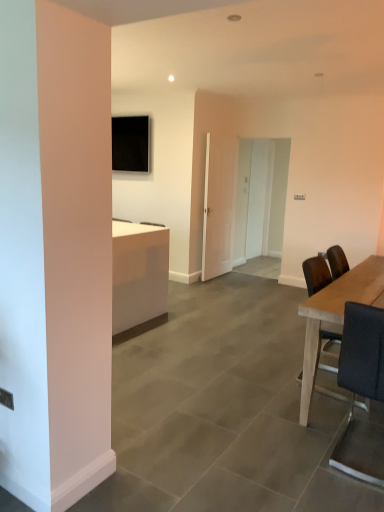
This screenshot has width=384, height=512. What do you see at coordinates (217, 206) in the screenshot?
I see `white glossy door at center, which is the first glass door from front to back` at bounding box center [217, 206].

Based on the photo, measure the distance between white glossy door at center, which is the first glass door from front to back, and camera.

white glossy door at center, which is the first glass door from front to back, and camera are 18.13 feet apart from each other.

Measure the distance between white glossy door at center, which ranks as the 1th glass door in back-to-front order, and camera.

white glossy door at center, which ranks as the 1th glass door in back-to-front order, is 23.34 feet away from camera.

The width and height of the screenshot is (384, 512). What are the coordinates of `white glossy door at center, the second glass door when ordered from front to back` in the screenshot? It's located at (261, 198).

The height and width of the screenshot is (512, 384). Find the location of `white glossy door at center, which is the first glass door from front to back`. white glossy door at center, which is the first glass door from front to back is located at coordinates (217, 206).

Is light brown wooden table at right bigger than white glossy door at center, which ranks as the 1th glass door in back-to-front order?

Yes, light brown wooden table at right is bigger than white glossy door at center, which ranks as the 1th glass door in back-to-front order.

Can we say light brown wooden table at right lies outside white glossy door at center, the third glass door when ordered from front to back?

light brown wooden table at right lies outside white glossy door at center, the third glass door when ordered from front to back,'s area.

Is point (321, 322) more distant than point (249, 199)?

No.

Which object is positioned more to the left, white glossy door at center, the third glass door when ordered from front to back, or black leather chair at right?

From the viewer's perspective, black leather chair at right appears more on the left side.

From a real-world perspective, who is located lower, white glossy door at center, which ranks as the 1th glass door in back-to-front order, or black leather chair at right?

black leather chair at right.

From a real-world perspective, who is located lower, white glossy door at center, the 2th glass door from the back, or black leather chair at right?

From a 3D spatial view, black leather chair at right is below.

Is white glossy door at center, the second glass door when ordered from front to back, looking in the opposite direction of black leather chair at right?

white glossy door at center, the second glass door when ordered from front to back, does not have its back to black leather chair at right.

Does point (267, 229) come closer to viewer compared to point (371, 464)?

No, (267, 229) is behind (371, 464).

Based on the photo, can you confirm if white glossy door at center, the second glass door when ordered from front to back, is wider than black leather chair at right?

No, white glossy door at center, the second glass door when ordered from front to back, is not wider than black leather chair at right.

Does point (341, 301) come farther from viewer compared to point (358, 323)?

Yes.

From the picture: From a real-world perspective, is light brown wooden table at right below black leather chair at right?

Yes.

Which object is positioned more to the right, light brown wooden table at right or black leather chair at right?

Positioned to the right is light brown wooden table at right.

From the image's perspective, would you say light brown wooden table at right is shown under black leather chair at right?

No.

Can you confirm if white glossy door at center, the second glass door when ordered from front to back, is bigger than white glossy door at center, which ranks as the 1th glass door in back-to-front order?

Indeed, white glossy door at center, the second glass door when ordered from front to back, has a larger size compared to white glossy door at center, which ranks as the 1th glass door in back-to-front order.

Consider the image. Is white glossy door at center, the second glass door when ordered from front to back, at the left side of white glossy door at center, which ranks as the 1th glass door in back-to-front order?

Correct, you'll find white glossy door at center, the second glass door when ordered from front to back, to the left of white glossy door at center, which ranks as the 1th glass door in back-to-front order.

Relative to white glossy door at center, the third glass door when ordered from front to back, is white glossy door at center, the second glass door when ordered from front to back, in front or behind?

white glossy door at center, the second glass door when ordered from front to back, is positioned closer to the viewer than white glossy door at center, the third glass door when ordered from front to back.

Which of these two, black leather chair at right or white glossy door at center, the second glass door when ordered from front to back, is thinner?

Thinner between the two is white glossy door at center, the second glass door when ordered from front to back.

Does black leather chair at right contain white glossy door at center, the second glass door when ordered from front to back?

Actually, white glossy door at center, the second glass door when ordered from front to back, is outside black leather chair at right.

Looking at this image, is black leather chair at right taller than white glossy door at center, the 2th glass door from the back?

Incorrect, the height of black leather chair at right is not larger of that of white glossy door at center, the 2th glass door from the back.

Does black leather chair at right have a smaller size compared to white glossy door at center, the second glass door when ordered from front to back?

Indeed, black leather chair at right has a smaller size compared to white glossy door at center, the second glass door when ordered from front to back.

Which is nearer, (361, 471) or (218, 154)?

Point (361, 471) is positioned closer to the camera compared to point (218, 154).

Is black leather chair at right placed right next to white glossy door at center, which is the third glass door from back to front?

No.

From the image's perspective, is black leather chair at right above or below white glossy door at center, which is the first glass door from front to back?

black leather chair at right is situated lower than white glossy door at center, which is the first glass door from front to back, in the image.

Is black leather chair at right wider or thinner than white glossy door at center, which is the third glass door from back to front?

Considering their sizes, black leather chair at right looks broader than white glossy door at center, which is the third glass door from back to front.

Image resolution: width=384 pixels, height=512 pixels. I want to click on table to the right of white glossy door at center, which ranks as the 1th glass door in back-to-front order, so click(336, 315).

I want to click on chair below the white glossy door at center, the third glass door when ordered from front to back (from the image's perspective), so click(360, 375).

Based on their spatial positions, is light brown wooden table at right or white glossy door at center, which ranks as the 1th glass door in back-to-front order, closer to black leather chair at right?

Based on the image, light brown wooden table at right appears to be nearer to black leather chair at right.

Considering their positions, is light brown wooden table at right positioned closer to white glossy door at center, which ranks as the 1th glass door in back-to-front order, than black leather chair at right?

light brown wooden table at right is closer to white glossy door at center, which ranks as the 1th glass door in back-to-front order.

Looking at the image, which one is located closer to black leather chair at right, white glossy door at center, which is the third glass door from back to front, or light brown wooden table at right?

light brown wooden table at right lies closer to black leather chair at right than the other object.

When comparing their distances from light brown wooden table at right, does black leather chair at right or white glossy door at center, which ranks as the 1th glass door in back-to-front order, seem closer?

The object closer to light brown wooden table at right is black leather chair at right.

Considering their positions, is light brown wooden table at right positioned further to white glossy door at center, which is the third glass door from back to front, than black leather chair at right?

The object further to white glossy door at center, which is the third glass door from back to front, is black leather chair at right.

From the image, which object appears to be farther from black leather chair at right, white glossy door at center, the 2th glass door from the back, or white glossy door at center, which ranks as the 1th glass door in back-to-front order?

Based on the image, white glossy door at center, which ranks as the 1th glass door in back-to-front order, appears to be further to black leather chair at right.

Based on their spatial positions, is white glossy door at center, the third glass door when ordered from front to back, or white glossy door at center, which is the third glass door from back to front, closer to black leather chair at right?

white glossy door at center, which is the third glass door from back to front, is closer to black leather chair at right.

Looking at the image, which one is located further to white glossy door at center, which is the first glass door from front to back, black leather chair at right or white glossy door at center, the third glass door when ordered from front to back?

black leather chair at right lies further to white glossy door at center, which is the first glass door from front to back, than the other object.

Where is `glass door between black leather chair at right and white glossy door at center, the second glass door when ordered from front to back, in the front-back direction`? glass door between black leather chair at right and white glossy door at center, the second glass door when ordered from front to back, in the front-back direction is located at coordinates (217, 206).

The image size is (384, 512). Find the location of `table between black leather chair at right and white glossy door at center, which is the first glass door from front to back, along the z-axis`. table between black leather chair at right and white glossy door at center, which is the first glass door from front to back, along the z-axis is located at coordinates (336, 315).

The height and width of the screenshot is (512, 384). In order to click on table between black leather chair at right and white glossy door at center, the third glass door when ordered from front to back, in the front-back direction in this screenshot , I will do `click(336, 315)`.

Identify the location of glass door located between white glossy door at center, which is the third glass door from back to front, and white glossy door at center, the third glass door when ordered from front to back, in the depth direction. The height and width of the screenshot is (512, 384). (261, 198).